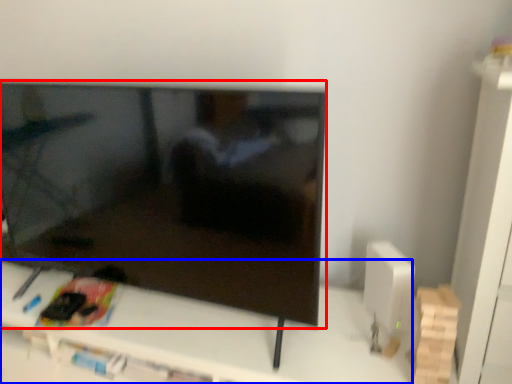
Question: Which of the following is the farthest to the observer, television (highlighted by a red box) or furniture (highlighted by a blue box)?

Choices:
 (A) television
 (B) furniture

Answer: (B)